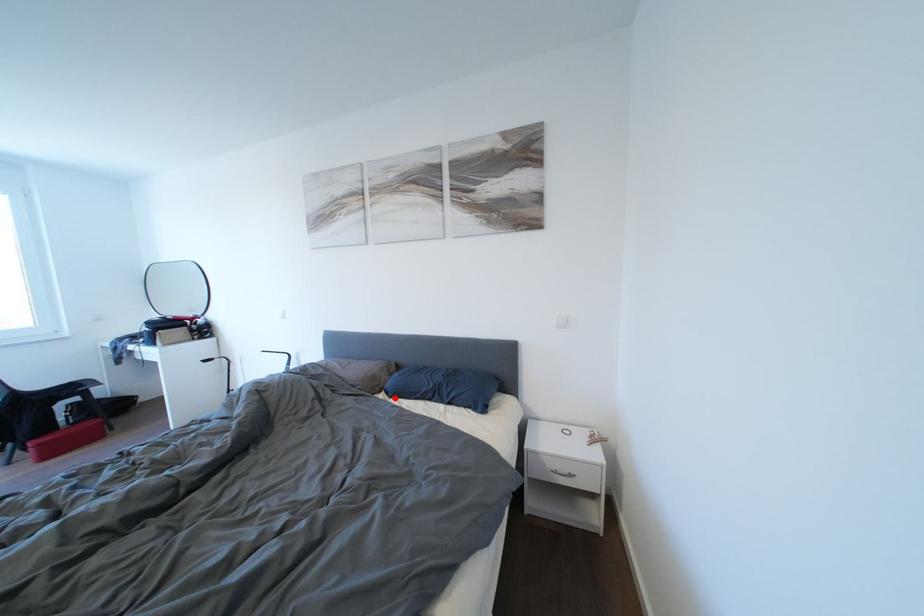
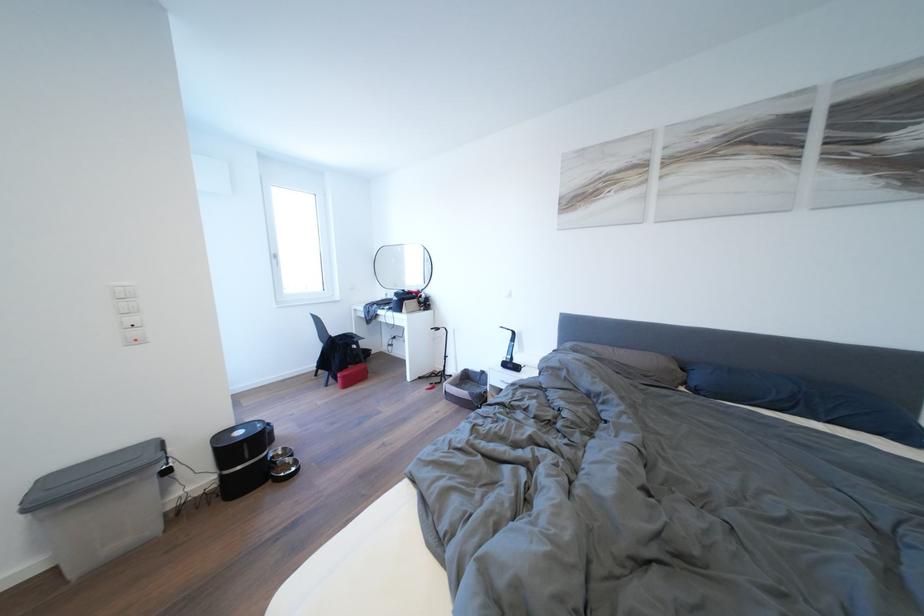
Question: I am providing you with two images of the same scene from different viewpoints. Given a red point in image1, look at the same physical point in image2. Is it:

Choices:
 (A) Closer to the viewpoint
 (B) Farther from the viewpoint

Answer: (A)